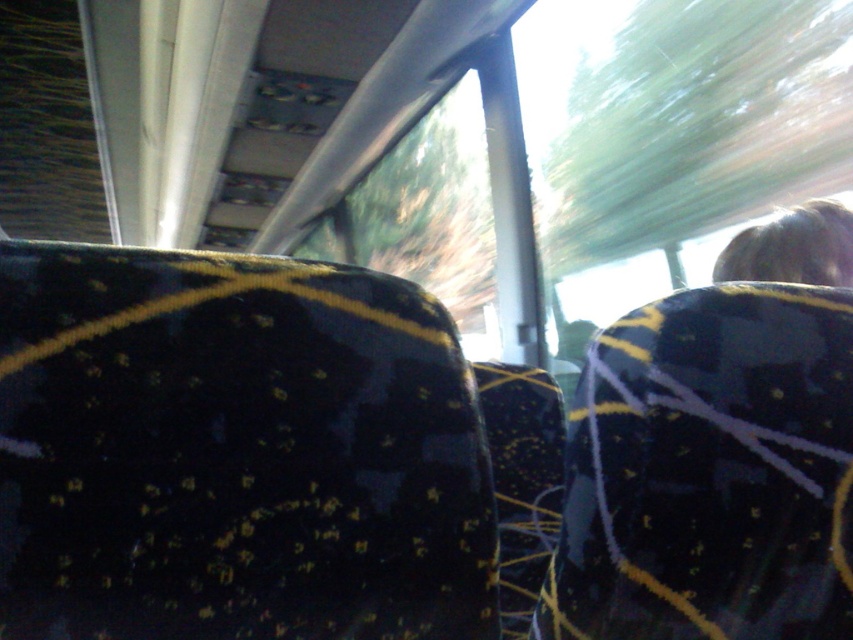
You are sitting in the vehicle and want to take a photo of both the point at coordinates (561,637) and the point at coordinates (595,156). Which point should you focus on first to ensure both are in focus?

You should focus on the point at coordinates (595,156) first because it is farther from the camera than the point at coordinates (561,637). By focusing on the farther point, both points will be in focus due to the depth of field.